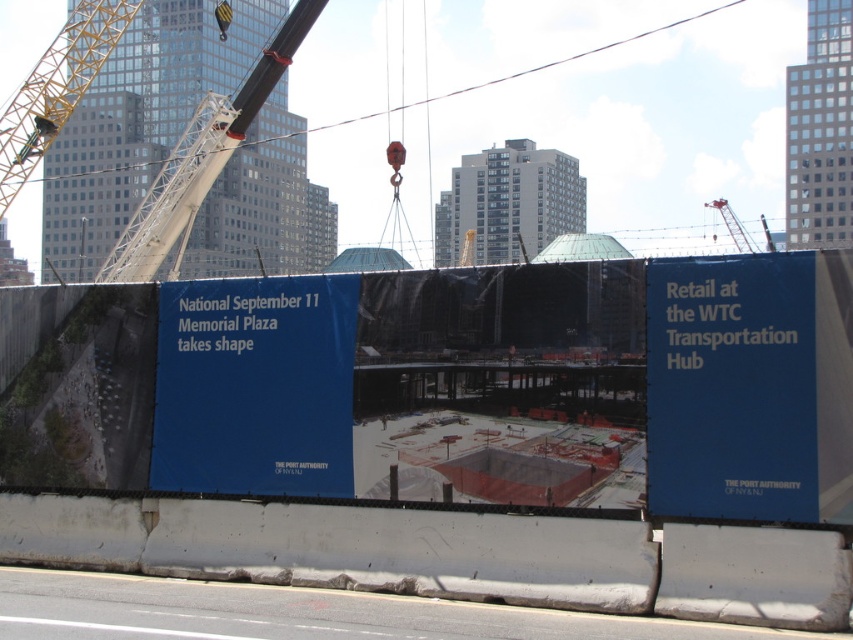
What do you see at coordinates (445, 436) in the screenshot? Image resolution: width=853 pixels, height=640 pixels. I see `blue fabric construction site at center` at bounding box center [445, 436].

Looking at this image, does blue fabric construction site at center appear on the left side of blue paper at upper right?

Indeed, blue fabric construction site at center is positioned on the left side of blue paper at upper right.

Where is `blue fabric construction site at center`? blue fabric construction site at center is located at coordinates (445, 436).

This screenshot has width=853, height=640. I want to click on blue fabric construction site at center, so click(x=445, y=436).

How distant is blue paper at upper right from metallic gray crane at upper left?

blue paper at upper right and metallic gray crane at upper left are 22.46 meters apart from each other.

In the scene shown: Is blue paper at upper right smaller than metallic gray crane at upper left?

Correct, blue paper at upper right occupies less space than metallic gray crane at upper left.

Does point (785, 460) come in front of point (177, 140)?

Yes, point (785, 460) is in front of point (177, 140).

Locate an element on the screen. This screenshot has width=853, height=640. blue paper at upper right is located at coordinates (750, 387).

Is blue fabric construction site at center above metallic gray crane at upper left?

Actually, blue fabric construction site at center is below metallic gray crane at upper left.

Find the location of `blue fabric construction site at center`. blue fabric construction site at center is located at coordinates (445, 436).

Locate an element on the screen. blue fabric construction site at center is located at coordinates (445, 436).